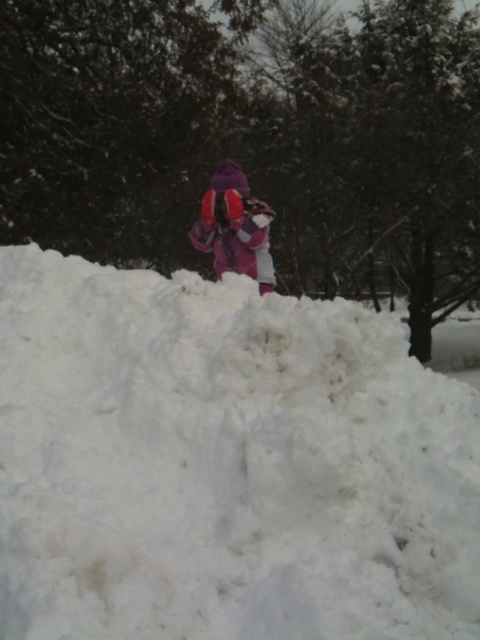
Is white fluffy snow at center below purple fleece jacket at center?

Indeed, white fluffy snow at center is positioned under purple fleece jacket at center.

At what (x,y) coordinates should I click in order to perform the action: click on white fluffy snow at center. Please return your answer as a coordinate pair (x, y). Image resolution: width=480 pixels, height=640 pixels. Looking at the image, I should click on (224, 464).

Who is more distant from viewer, (460, 432) or (247, 195)?

The point (247, 195) is behind.

The width and height of the screenshot is (480, 640). I want to click on white fluffy snow at center, so click(x=224, y=464).